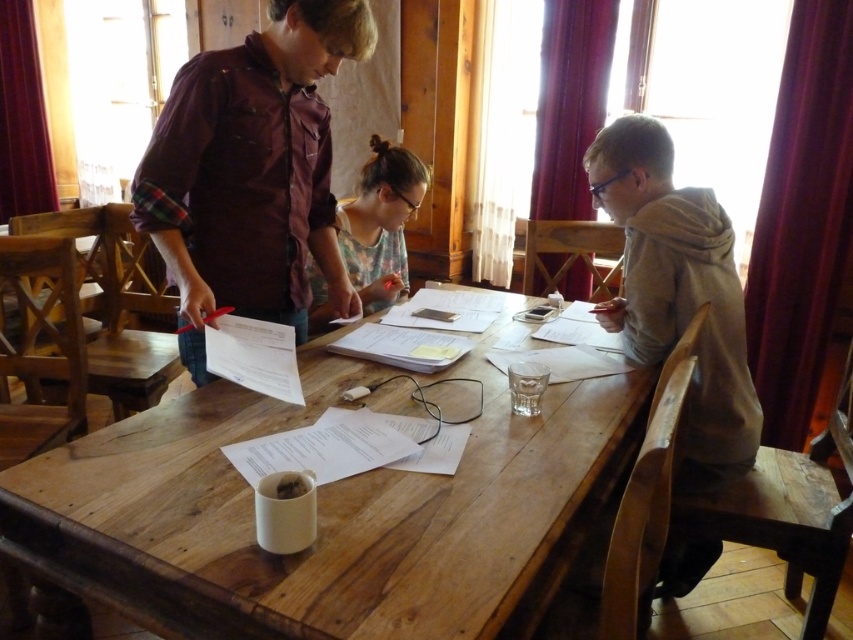
You are standing in the room and want to reach the point at coordinates [292,628]. If your arm can extend 30 inches, can you reach that point without moving?

The point at coordinates [292,628] is 34.14 inches away from you, which is beyond the 30 inches your arm can extend. Therefore, you cannot reach it without moving.

You are a photographer trying to capture a group photo of the maroon plaid shirt at center and the floral fabric shirt at center. Since you want to ensure both are in focus, you need to know their heights. Which of the two is taller?

The maroon plaid shirt at center is taller than the floral fabric shirt at center, so the maroon plaid shirt at center is taller.

You are a photographer planning to take a group photo of the gray matte hoodie at right and the floral fabric shirt at center. To ensure both subjects are centered in the frame, where should you position the camera relative to their current positions?

The gray matte hoodie at right is positioned on the right side of the floral fabric shirt at center, so to center both in the frame, the camera should be positioned directly in front of the floral fabric shirt at center, slightly to the left to account for the hoodie at right being further right.